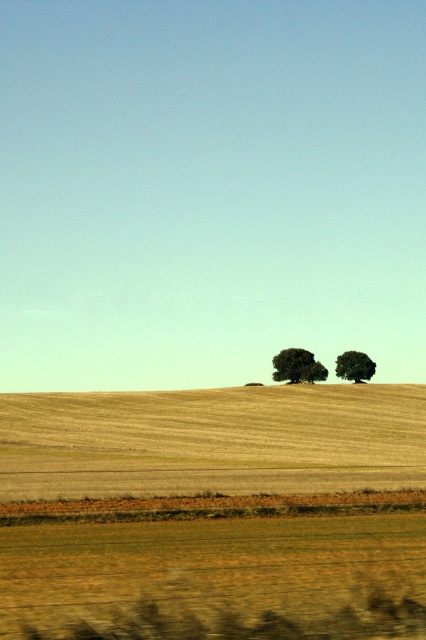
Can you confirm if golden textured wheat field at lower center is smaller than green matte tree at center?

No.

This screenshot has width=426, height=640. Describe the element at coordinates (213, 512) in the screenshot. I see `golden textured wheat field at lower center` at that location.

What are the coordinates of `golden textured wheat field at lower center` in the screenshot? It's located at (213, 512).

At what (x,y) coordinates should I click in order to perform the action: click on golden textured wheat field at lower center. Please return your answer as a coordinate pair (x, y). This screenshot has height=640, width=426. Looking at the image, I should click on (213, 512).

Is point (222, 604) less distant than point (327, 481)?

That is True.

Between golden textured wheat field at lower center and golden dry grass at center, which one appears on the left side from the viewer's perspective?

golden textured wheat field at lower center is more to the left.

Image resolution: width=426 pixels, height=640 pixels. I want to click on golden textured wheat field at lower center, so click(x=213, y=512).

At what (x,y) coordinates should I click in order to perform the action: click on golden textured wheat field at lower center. Please return your answer as a coordinate pair (x, y). The height and width of the screenshot is (640, 426). Looking at the image, I should click on (213, 512).

Is golden dry grass at center to the left of green matte tree at center from the viewer's perspective?

Indeed, golden dry grass at center is positioned on the left side of green matte tree at center.

Can you confirm if golden dry grass at center is smaller than green matte tree at center?

Incorrect, golden dry grass at center is not smaller in size than green matte tree at center.

Who is more forward, (402, 433) or (311, 381)?

Point (402, 433) is in front.

This screenshot has height=640, width=426. In order to click on golden dry grass at center in this screenshot , I will do `click(213, 442)`.